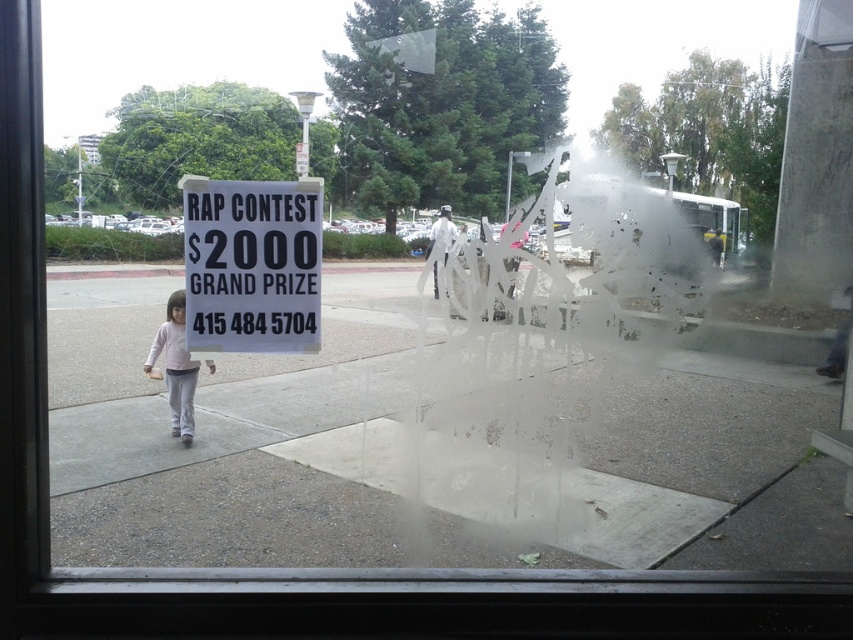
You are a delivery person trying to read the phone number on the white paper sign at center. However, you notice a light pink fabric child at lower left in your way. Can you see the phone number clearly?

The white paper sign at center is in front of the light pink fabric child at lower left, so the sign is blocking the child from view but the phone number on the sign should still be visible to you.

You are standing in front of a window and see a white paper sign at center. If you want to reach the sign by walking straight ahead, will you be able to touch it without moving your arms?

The white paper sign at center is located at point [252,264], which suggests it is positioned outside the window. Since you are inside, walking straight ahead would not allow you to touch it without moving your arms, as the window separates you from the sign.

You are looking through a window at a poster for a RAP CONTEST. There are two points marked on the poster. One is at coordinates point [312,298] and the other at point [186,397]. Which point is closer to you?

Point [312,298] is in front of point [186,397], so it is closer to you.